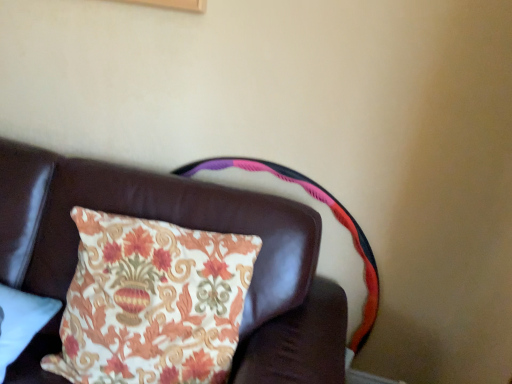
Question: Considering the relative sizes of leather couch cushion at upper left and floral fabric cushion at upper center in the image provided, is leather couch cushion at upper left shorter than floral fabric cushion at upper center?

Choices:
 (A) yes
 (B) no

Answer: (B)

Question: Can you confirm if leather couch cushion at upper left is bigger than floral fabric cushion at upper center?

Choices:
 (A) yes
 (B) no

Answer: (A)

Question: From a real-world perspective, is leather couch cushion at upper left positioned under floral fabric cushion at upper center based on gravity?

Choices:
 (A) no
 (B) yes

Answer: (B)

Question: From the image's perspective, is leather couch cushion at upper left on top of floral fabric cushion at upper center?

Choices:
 (A) yes
 (B) no

Answer: (B)

Question: Is leather couch cushion at upper left taller than floral fabric cushion at upper center?

Choices:
 (A) yes
 (B) no

Answer: (A)

Question: Considering the relative positions of leather couch cushion at upper left and floral fabric cushion at upper center in the image provided, is leather couch cushion at upper left to the right of floral fabric cushion at upper center from the viewer's perspective?

Choices:
 (A) yes
 (B) no

Answer: (B)

Question: Can you confirm if floral fabric pillow at lower left is thinner than leather couch cushion at upper left?

Choices:
 (A) no
 (B) yes

Answer: (B)

Question: From a real-world perspective, is floral fabric pillow at lower left beneath leather couch cushion at upper left?

Choices:
 (A) no
 (B) yes

Answer: (A)

Question: Would you consider floral fabric pillow at lower left to be distant from leather couch cushion at upper left?

Choices:
 (A) yes
 (B) no

Answer: (B)

Question: Is floral fabric pillow at lower left to the right of leather couch cushion at upper left from the viewer's perspective?

Choices:
 (A) yes
 (B) no

Answer: (B)

Question: Is floral fabric pillow at lower left positioned in front of leather couch cushion at upper left?

Choices:
 (A) yes
 (B) no

Answer: (B)

Question: From a real-world perspective, is floral fabric pillow at lower left on leather couch cushion at upper left?

Choices:
 (A) yes
 (B) no

Answer: (A)

Question: Is floral fabric cushion at upper center at the right side of leather couch cushion at upper left?

Choices:
 (A) no
 (B) yes

Answer: (B)